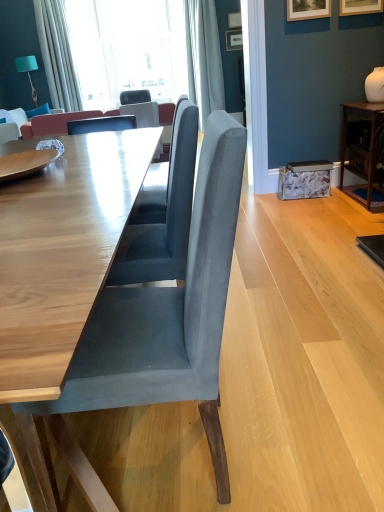
Locate an element on the screen. Image resolution: width=384 pixels, height=512 pixels. vacant area situated below suede gray chair at center, the first chair from the bottom (from a real-world perspective) is located at coordinates (150, 454).